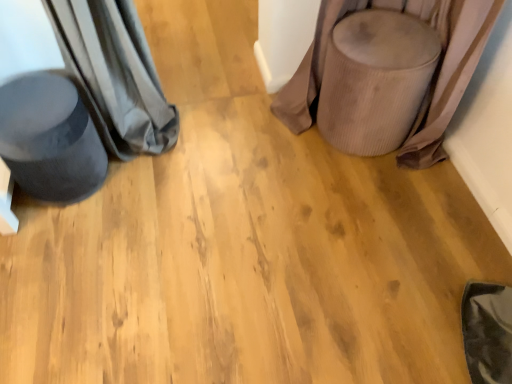
The height and width of the screenshot is (384, 512). I want to click on vacant region in front of velvet dark grey swivel chair at left, which is the 1th swivel chair in left-to-right order, so click(x=62, y=245).